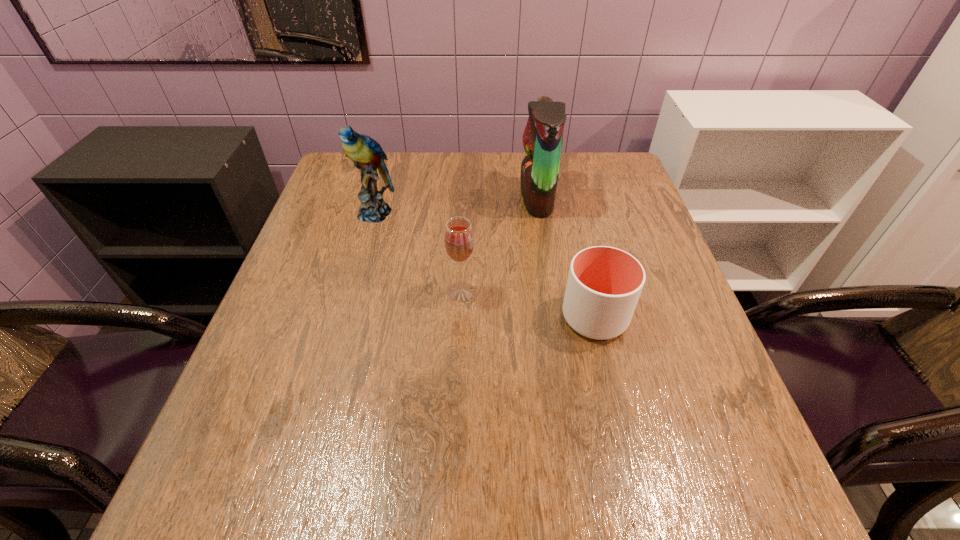
This screenshot has width=960, height=540. What are the coordinates of `free point between the shortest object and the right parrot` in the screenshot? It's located at click(x=565, y=258).

This screenshot has width=960, height=540. I want to click on free space between the right parrot and the left parrot, so click(456, 205).

The image size is (960, 540). Find the location of `vacant space that is in between the right parrot and the shortest object`. vacant space that is in between the right parrot and the shortest object is located at coordinates (565, 258).

Where is `unoccupied area between the left parrot and the right parrot`? The image size is (960, 540). unoccupied area between the left parrot and the right parrot is located at coordinates (456, 205).

Find the location of a particular element. Image resolution: width=960 pixels, height=540 pixels. empty space that is in between the leftmost object and the right parrot is located at coordinates (456, 205).

Find the location of a particular element. The image size is (960, 540). unoccupied position between the left parrot and the right parrot is located at coordinates (456, 205).

Locate an element on the screen. This screenshot has width=960, height=540. free area in between the second shortest object and the leftmost object is located at coordinates (419, 252).

This screenshot has height=540, width=960. I want to click on free space between the left parrot and the cup, so click(485, 265).

I want to click on vacant area between the shortest object and the third tallest object, so click(x=528, y=305).

Locate an element on the screen. free space between the left parrot and the cup is located at coordinates (485, 265).